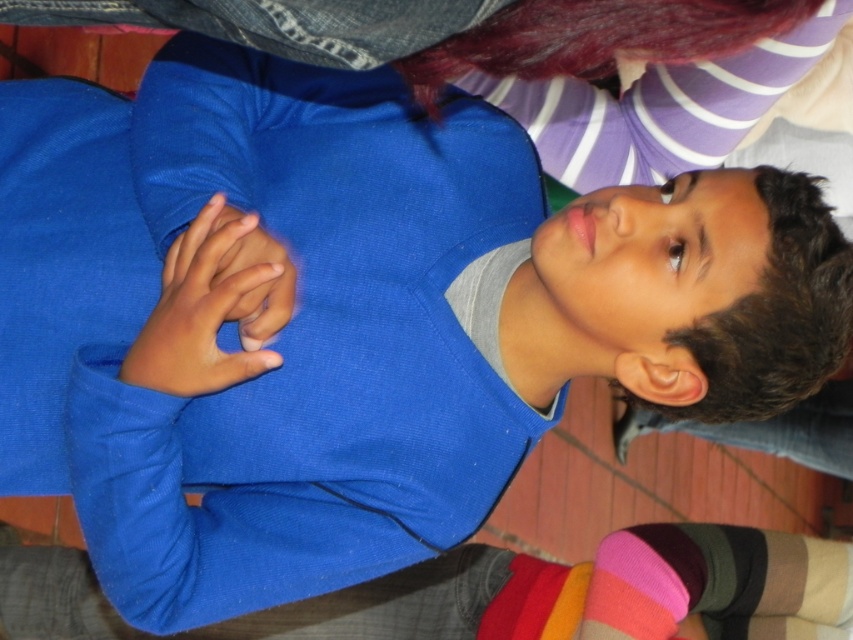
Describe the element at coordinates (196, 314) in the screenshot. This screenshot has width=853, height=640. I see `smooth blue hand at center` at that location.

Between point (279, 356) and point (607, 627), which one is positioned in front?

Point (279, 356)

The width and height of the screenshot is (853, 640). I want to click on smooth blue hand at center, so click(x=196, y=314).